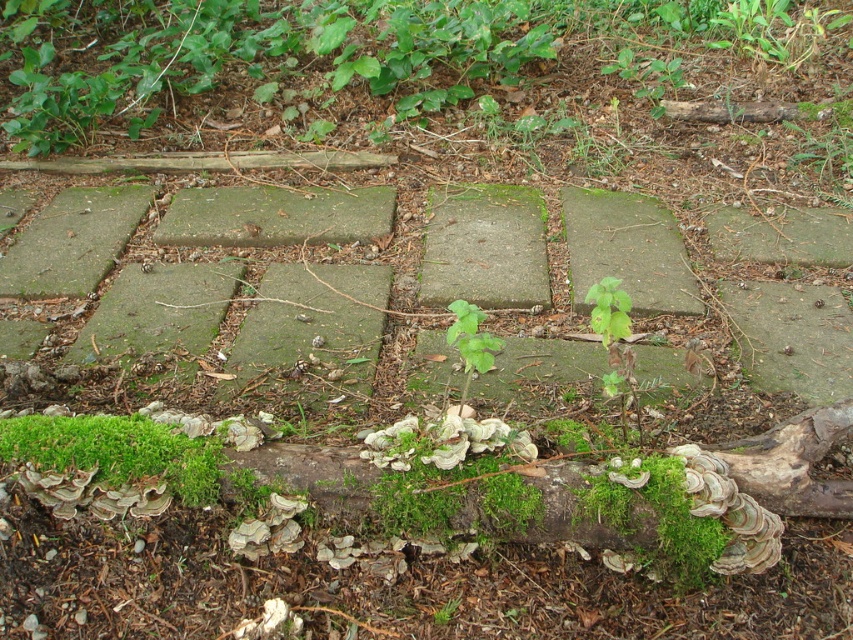
Question: Based on their relative distances, which object is farther from the green leafy plant at center?

Choices:
 (A) green mossy log at upper center
 (B) green mossy plant at center
 (C) green mossy log at lower left

Answer: (A)

Question: In this image, where is green mossy log at lower left located relative to green mossy plant at center?

Choices:
 (A) above
 (B) below

Answer: (A)

Question: Which point is closer to the camera?

Choices:
 (A) (440, 618)
 (B) (300, 24)
 (C) (461, 317)
 (D) (187, 486)

Answer: (A)

Question: Which object is the closest to the green mossy log at upper center?

Choices:
 (A) green mossy log at lower left
 (B) green mossy plant at center
 (C) green leafy plant at center

Answer: (C)

Question: Is green mossy log at upper center above green leafy plant at center?

Choices:
 (A) no
 (B) yes

Answer: (B)

Question: Is green mossy log at upper center to the right of green mossy log at lower left from the viewer's perspective?

Choices:
 (A) no
 (B) yes

Answer: (B)